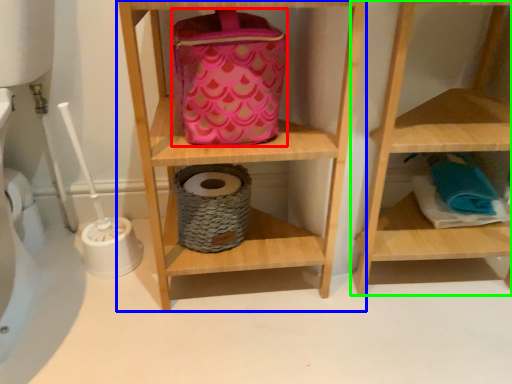
Question: Considering the real-world distances, which object is farthest from pouch (highlighted by a red box)? shelf (highlighted by a blue box) or shelf (highlighted by a green box)?

Choices:
 (A) shelf
 (B) shelf

Answer: (B)